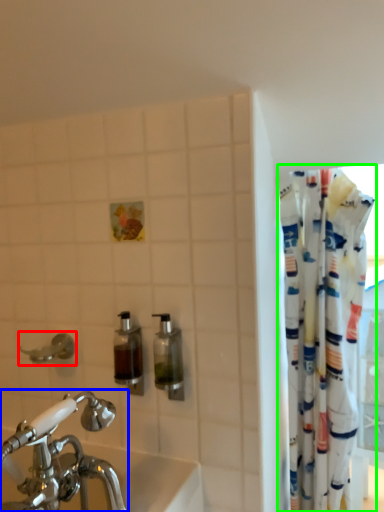
Question: Which object is the farthest from plumbing fixture (highlighted by a red box)? Choose among these: tap (highlighted by a blue box) or curtain (highlighted by a green box).

Choices:
 (A) tap
 (B) curtain

Answer: (B)